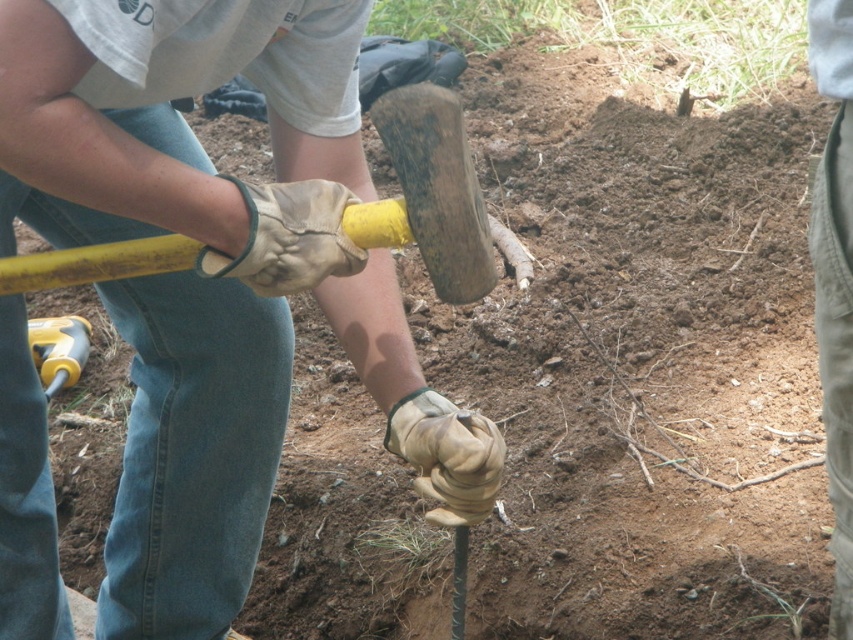
Question: From the image, what is the correct spatial relationship of wooden hammer at center in relation to yellow plastic handle at lower left?

Choices:
 (A) above
 (B) below

Answer: (B)

Question: Is wooden hammer at center positioned before yellow plastic handle at lower left?

Choices:
 (A) yes
 (B) no

Answer: (A)

Question: Can you confirm if wooden hammer at center is positioned to the right of yellow plastic handle at lower left?

Choices:
 (A) yes
 (B) no

Answer: (A)

Question: Which point appears closest to the camera in this image?

Choices:
 (A) (184, 497)
 (B) (45, 336)

Answer: (A)

Question: Which point is farther from the camera taking this photo?

Choices:
 (A) (85, 362)
 (B) (65, 93)

Answer: (A)